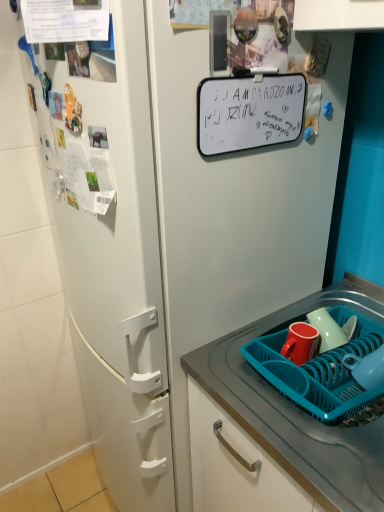
Locate an element on the screen. vacant space to the right of glossy ceramic mug at lower right is located at coordinates (362, 337).